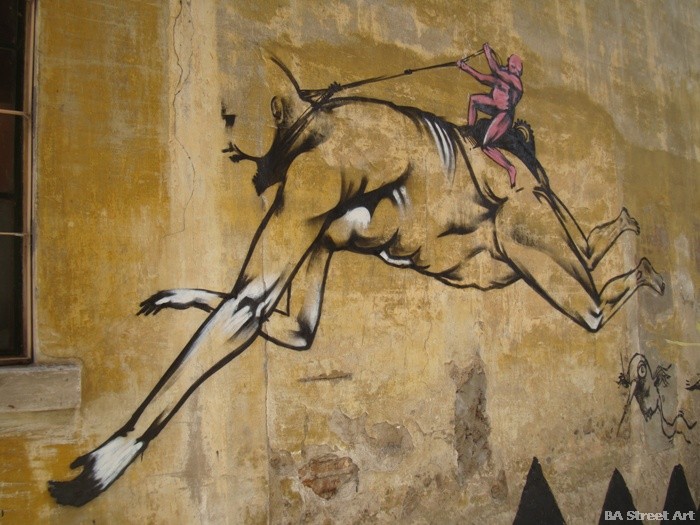
You are a GUI agent. You are given a task and a screenshot of the screen. Output one action in this format:
    pyautogui.click(x=<x>, y=<y>)
    Task: Click on the wall
    The image size is (700, 525).
    Given the screenshot: What is the action you would take?
    pyautogui.click(x=588, y=75)